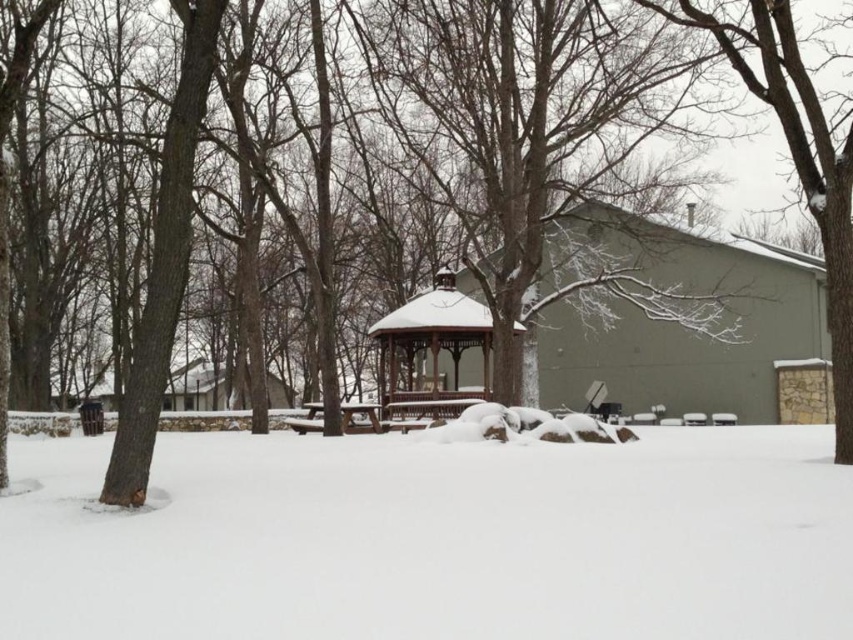
You are planning to build a snowman using the white fluffy snow at lower center and want to place it near the wooden gazebo at center. Considering their heights, will the snowman be shorter than the gazebo?

The white fluffy snow at lower center has a lesser height compared to the wooden gazebo at center, so the snowman made from the white fluffy snow at lower center will indeed be shorter than the wooden gazebo at center.